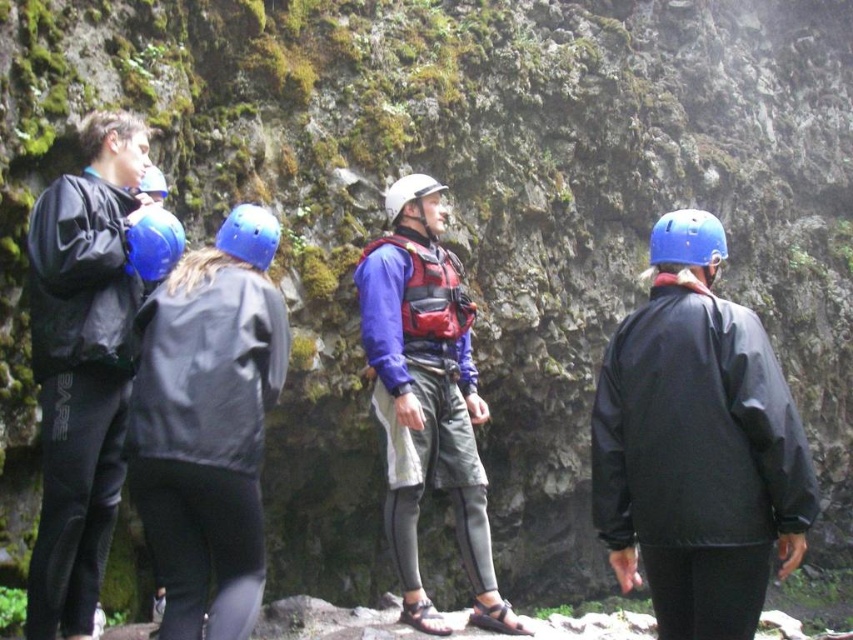
Question: Which of the following is the farthest from the observer?

Choices:
 (A) click(x=410, y=595)
 (B) click(x=137, y=307)

Answer: (A)

Question: From the image, what is the correct spatial relationship of matte black wetsuit at left in relation to matte blue helmet at center?

Choices:
 (A) right
 (B) left

Answer: (B)

Question: Which point is farther from the camera taking this photo?

Choices:
 (A) (390, 508)
 (B) (77, 564)

Answer: (A)

Question: From the image, what is the correct spatial relationship of matte black wetsuit at left in relation to matte blue helmet at center?

Choices:
 (A) left
 (B) right

Answer: (A)

Question: Is matte black wetsuit at left in front of matte blue helmet at center?

Choices:
 (A) no
 (B) yes

Answer: (B)